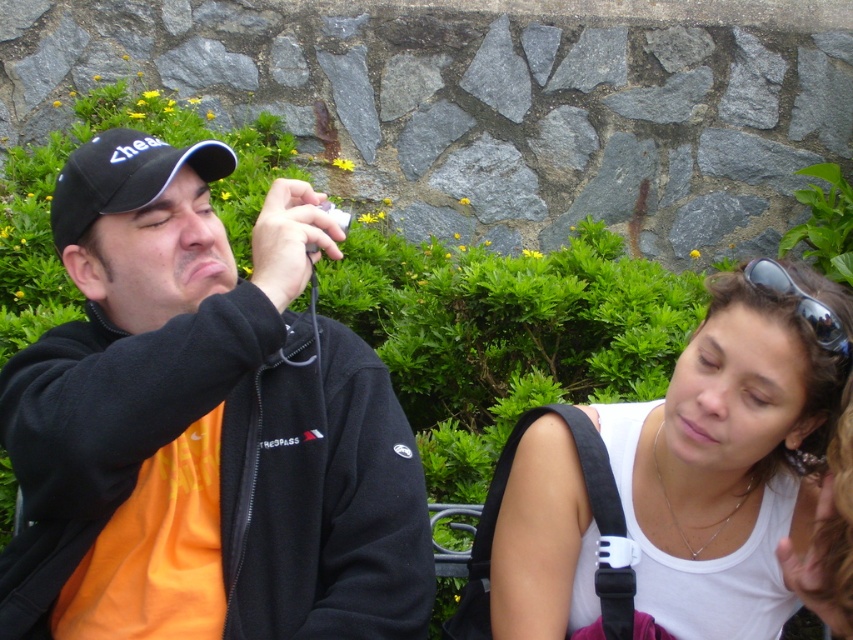
You are a photographer trying to decide whether to carry both the black matte camera at center and the white matte tank top at center in your small backpack. The backpack has a maximum capacity of 10 liters. If the camera takes up 8 liters and the tank top takes up 2 liters, will both items fit?

The black matte camera at center is larger in size than the white matte tank top at center. Since the camera occupies 8 liters and the tank top 2 liters, together they total 10 liters. Therefore, both items will exactly fit in the backpack as the combined volume matches the capacity.

You are a photographer trying to capture a candid shot of the two people on the stone bench. You notice the white matte tank top at center and the sunglasses at upper right. Which object is positioned lower in the image?

The white matte tank top at center is located below sunglasses at upper right, so it is positioned lower in the image.

You are a photographer trying to capture a detailed shot of the white matte tank top at center and the sunglasses at upper right. Which object should you zoom in on to ensure it fits entirely within your camera frame if the frame can only accommodate one of them?

The sunglasses at upper right are narrower than the white matte tank top at center, so you should zoom in on the sunglasses at upper right to ensure it fits within the camera frame.